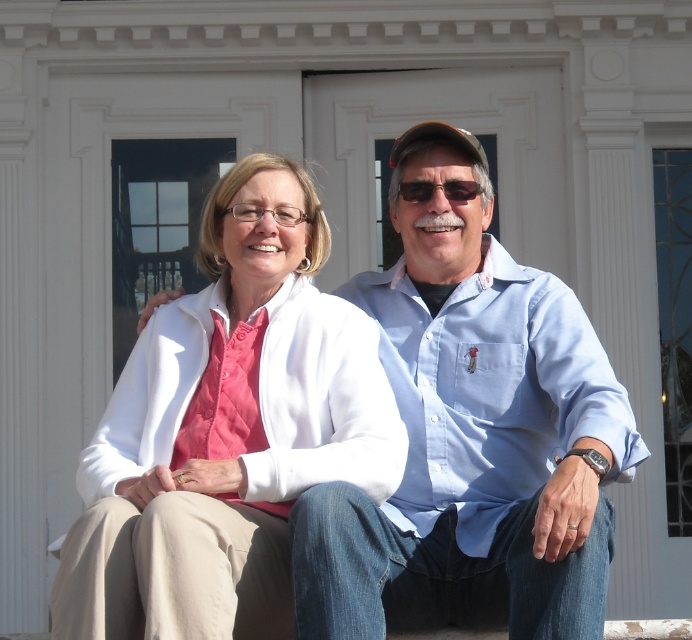
Question: Does blue cotton shirt at center appear on the left side of white matte jacket at center?

Choices:
 (A) no
 (B) yes

Answer: (A)

Question: Is blue cotton shirt at center to the left of white matte jacket at center from the viewer's perspective?

Choices:
 (A) no
 (B) yes

Answer: (A)

Question: Which of the following is the farthest from the observer?

Choices:
 (A) white matte jacket at center
 (B) blue cotton shirt at center

Answer: (B)

Question: Which of the following is the farthest from the observer?

Choices:
 (A) white matte jacket at center
 (B) blue cotton shirt at center

Answer: (B)

Question: Can you confirm if blue cotton shirt at center is positioned to the left of white matte jacket at center?

Choices:
 (A) yes
 (B) no

Answer: (B)